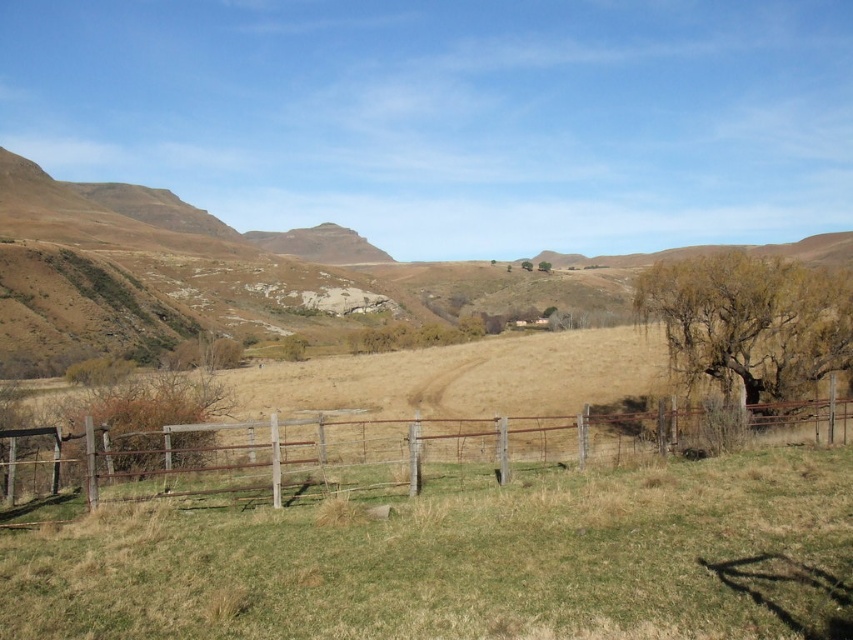
You are standing at the point marked as point (465, 561) in the image. What do you see directly in front of you?

The green grassy field at center is located at point (465, 561), so you would see the green grassy field at center directly in front of you.

You are standing in the middle of the green grassy field at center and want to reach the rusty wood fence at lower center. Which direction should you move to get closer to the fence?

Since the green grassy field at center is smaller than the rusty wood fence at lower center, you should move forward towards the lower part of the image to reach the rusty wood fence at lower center.

You are standing at the edge of the green grassy field at center and want to walk to the rusty wood fence at lower center. Which direction should you move to reach it?

You should move downward to reach the rusty wood fence at lower center because the green grassy field at center is located above it.